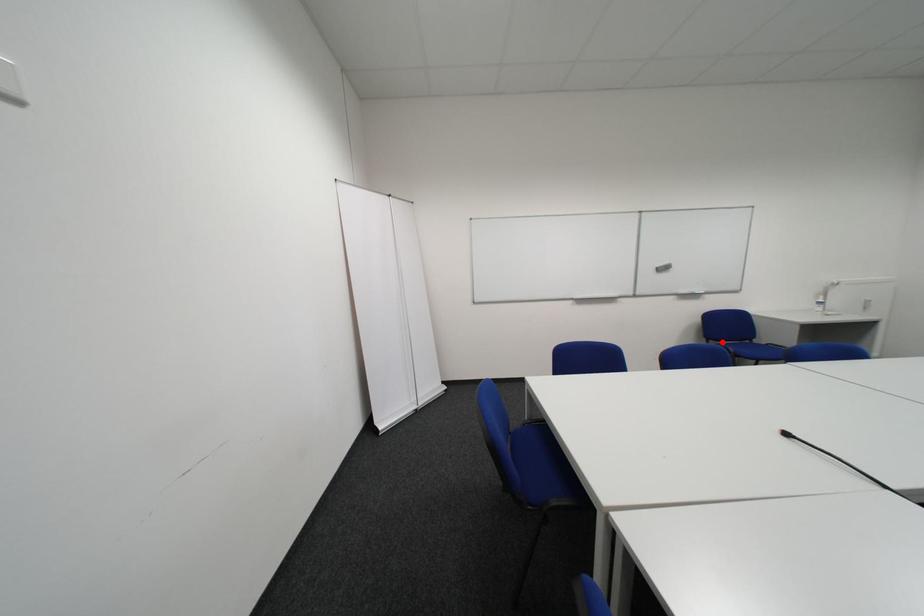
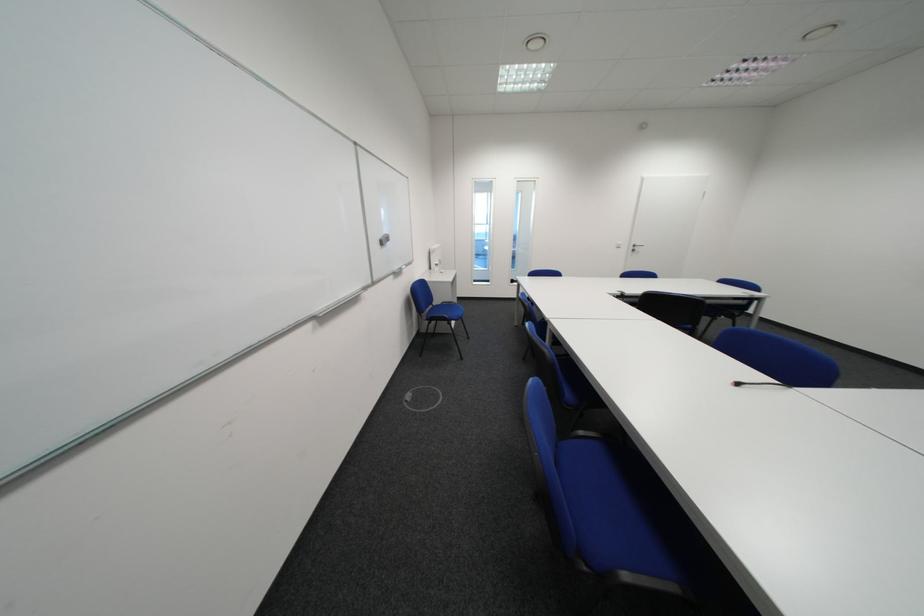
In the second image, find the point that corresponds to the highlighted location in the first image.

(434, 315)